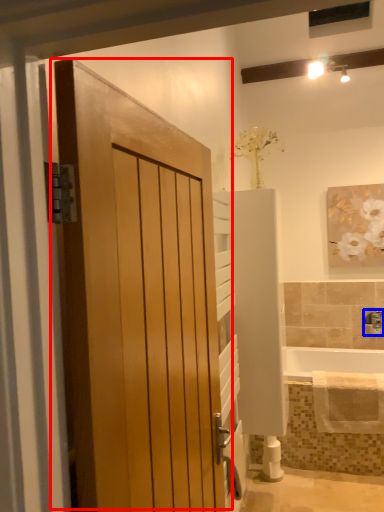
Question: Which object is further to the camera taking this photo, door (highlighted by a red box) or tap (highlighted by a blue box)?

Choices:
 (A) door
 (B) tap

Answer: (B)